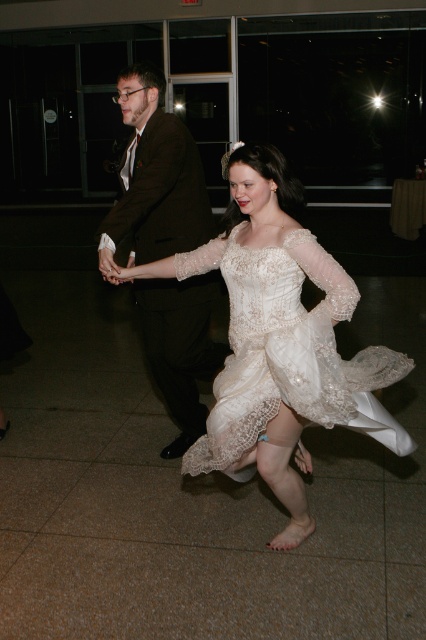
Question: Which point is farther to the camera?

Choices:
 (A) (290, 300)
 (B) (344, 365)

Answer: (B)

Question: Which point appears closest to the camera in this image?

Choices:
 (A) (198, 227)
 (B) (290, 400)
 (C) (227, 432)

Answer: (B)

Question: Which of the following is the closest to the observer?

Choices:
 (A) (235, 188)
 (B) (193, 234)
 (C) (316, 266)

Answer: (C)

Question: Is ivory lace dress at center to the right of dark brown suit at center from the viewer's perspective?

Choices:
 (A) yes
 (B) no

Answer: (A)

Question: Is white lace dress at center to the left of ivory lace dress at center from the viewer's perspective?

Choices:
 (A) no
 (B) yes

Answer: (B)

Question: Does white lace dress at center appear on the left side of dark brown suit at center?

Choices:
 (A) no
 (B) yes

Answer: (A)